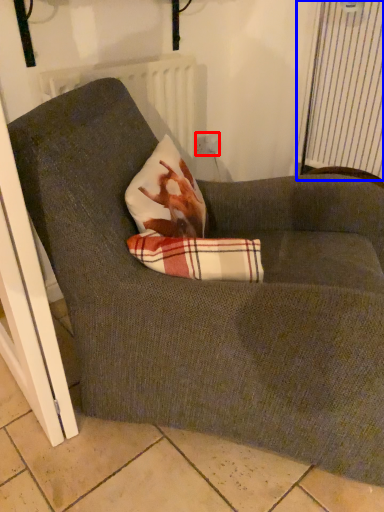
Question: Which of the following is the closest to the observer, electric outlet (highlighted by a red box) or curtain (highlighted by a blue box)?

Choices:
 (A) electric outlet
 (B) curtain

Answer: (B)